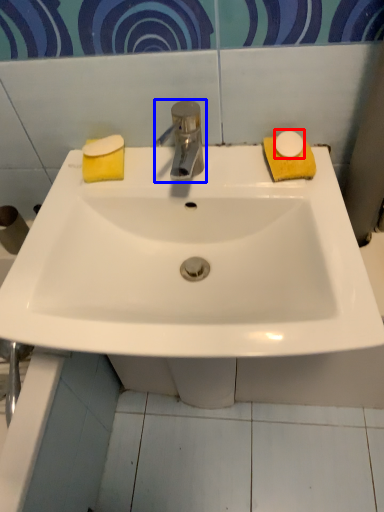
Question: Which point is closer to the camera, soap (highlighted by a red box) or tap (highlighted by a blue box)?

Choices:
 (A) soap
 (B) tap

Answer: (B)